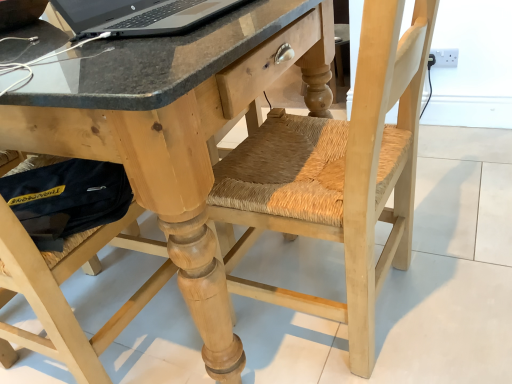
Measure the distance between natural wood swivel chair at center and camera.

natural wood swivel chair at center and camera are 21.16 inches apart from each other.

Identify the location of silver metallic laptop at upper left. (139, 16).

What do you see at coordinates (135, 149) in the screenshot? This screenshot has width=512, height=384. I see `natural wood desk at center` at bounding box center [135, 149].

Locate an element on the screen. natural wood swivel chair at center is located at coordinates (336, 177).

Between natural wood swivel chair at center and natural wood desk at center, which one has less height?

natural wood desk at center is shorter.

Can you tell me how much natural wood swivel chair at center and natural wood desk at center differ in facing direction?

The angular difference between natural wood swivel chair at center and natural wood desk at center is 177 degrees.

From a real-world perspective, is natural wood swivel chair at center above or below natural wood desk at center?

In terms of real-world spatial position, natural wood swivel chair at center is above natural wood desk at center.

From the image's perspective, is natural wood swivel chair at center positioned above or below natural wood desk at center?

natural wood swivel chair at center is below natural wood desk at center.

Is natural wood swivel chair at center in front of or behind silver metallic laptop at upper left in the image?

Clearly, natural wood swivel chair at center is in front of silver metallic laptop at upper left.

Is natural wood swivel chair at center turned away from silver metallic laptop at upper left?

natural wood swivel chair at center is not turned away from silver metallic laptop at upper left.

Would you consider natural wood swivel chair at center to be distant from silver metallic laptop at upper left?

natural wood swivel chair at center is near silver metallic laptop at upper left, not far away.

Between silver metallic laptop at upper left and natural wood desk at center, which one appears on the left side from the viewer's perspective?

From the viewer's perspective, natural wood desk at center appears more on the left side.

In terms of width, does silver metallic laptop at upper left look wider or thinner when compared to natural wood desk at center?

silver metallic laptop at upper left is thinner than natural wood desk at center.

Is silver metallic laptop at upper left beside natural wood swivel chair at center?

silver metallic laptop at upper left and natural wood swivel chair at center are not in contact.

From the image's perspective, which is above, silver metallic laptop at upper left or natural wood swivel chair at center?

silver metallic laptop at upper left, from the image's perspective.

Is silver metallic laptop at upper left facing towards natural wood swivel chair at center?

Yes.

Is silver metallic laptop at upper left in front of natural wood swivel chair at center?

No, silver metallic laptop at upper left is further to the viewer.

Considering the positions of points (120, 130) and (74, 39), is point (120, 130) closer to camera compared to point (74, 39)?

Yes, it is in front of point (74, 39).

In the image, is natural wood desk at center on the left side or the right side of silver metallic laptop at upper left?

From the image, it's evident that natural wood desk at center is to the left of silver metallic laptop at upper left.

Is natural wood desk at center closer to the viewer compared to silver metallic laptop at upper left?

Yes, natural wood desk at center is closer to the camera.

Is natural wood desk at center positioned far away from silver metallic laptop at upper left?

No, natural wood desk at center is not far away from silver metallic laptop at upper left.

From the picture: Would you say natural wood desk at center is a long distance from natural wood swivel chair at center?

No, natural wood desk at center is not far away from natural wood swivel chair at center.

Who is taller, natural wood desk at center or natural wood swivel chair at center?

Standing taller between the two is natural wood swivel chair at center.

From a real-world perspective, is natural wood desk at center over natural wood swivel chair at center?

Incorrect, from a real-world perspective, natural wood desk at center is lower than natural wood swivel chair at center.

At what (x,y) coordinates should I click in order to perform the action: click on swivel chair that appears above the natural wood desk at center (from a real-world perspective). Please return your answer as a coordinate pair (x, y). Looking at the image, I should click on (336, 177).

Where is `laptop lying behind the natural wood swivel chair at center`? The width and height of the screenshot is (512, 384). laptop lying behind the natural wood swivel chair at center is located at coordinates (139, 16).

When comparing their distances from natural wood desk at center, does natural wood swivel chair at center or silver metallic laptop at upper left seem closer?

Among the two, silver metallic laptop at upper left is located nearer to natural wood desk at center.

Considering their positions, is silver metallic laptop at upper left positioned further to natural wood desk at center than natural wood swivel chair at center?

natural wood swivel chair at center.

From the image, which object appears to be farther from silver metallic laptop at upper left, natural wood swivel chair at center or natural wood desk at center?

The object further to silver metallic laptop at upper left is natural wood swivel chair at center.

Looking at the image, which one is located further to natural wood swivel chair at center, silver metallic laptop at upper left or natural wood desk at center?

silver metallic laptop at upper left lies further to natural wood swivel chair at center than the other object.

Which object lies nearer to the anchor point natural wood swivel chair at center, natural wood desk at center or silver metallic laptop at upper left?

Based on the image, natural wood desk at center appears to be nearer to natural wood swivel chair at center.

Estimate the real-world distances between objects in this image. Which object is closer to silver metallic laptop at upper left, natural wood desk at center or natural wood swivel chair at center?

natural wood desk at center lies closer to silver metallic laptop at upper left than the other object.

Where is `laptop situated between natural wood desk at center and natural wood swivel chair at center from left to right`? The image size is (512, 384). laptop situated between natural wood desk at center and natural wood swivel chair at center from left to right is located at coordinates 139,16.